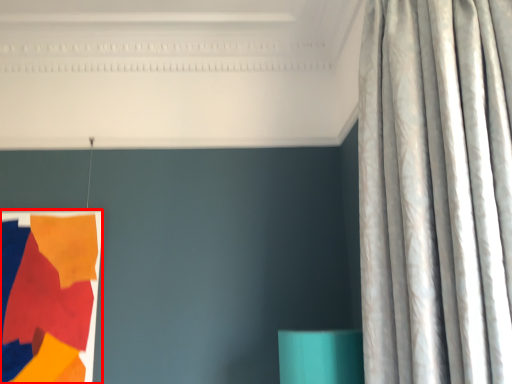
Question: From the image's perspective, where is tapestry (annotated by the red box) located relative to curtain?

Choices:
 (A) above
 (B) below

Answer: (B)